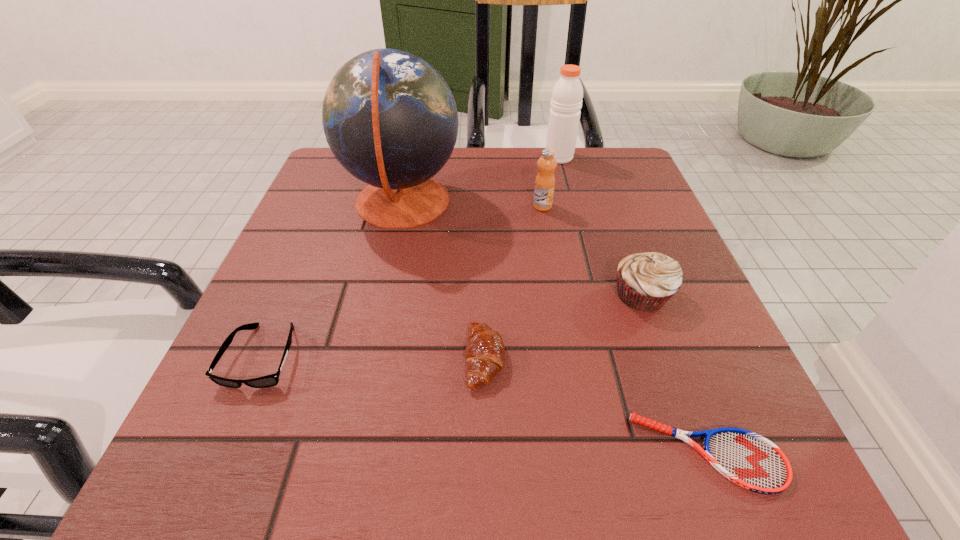
The height and width of the screenshot is (540, 960). Find the location of `the tallest object`. the tallest object is located at coordinates (390, 119).

Where is `the farthest object`? the farthest object is located at coordinates (566, 101).

This screenshot has height=540, width=960. I want to click on shaker, so click(x=566, y=101).

Find the location of a particular element. the fifth shortest object is located at coordinates (545, 180).

This screenshot has width=960, height=540. In order to click on orange juice in this screenshot , I will do `click(545, 180)`.

In order to click on muffin in this screenshot , I will do `click(645, 281)`.

Identify the location of the fourth nearest object. (645, 281).

The width and height of the screenshot is (960, 540). What are the coordinates of `crescent roll` in the screenshot? It's located at (485, 353).

In order to click on the third shortest object in this screenshot , I will do `click(485, 353)`.

The image size is (960, 540). What are the coordinates of `the sixth tallest object` in the screenshot? It's located at (271, 380).